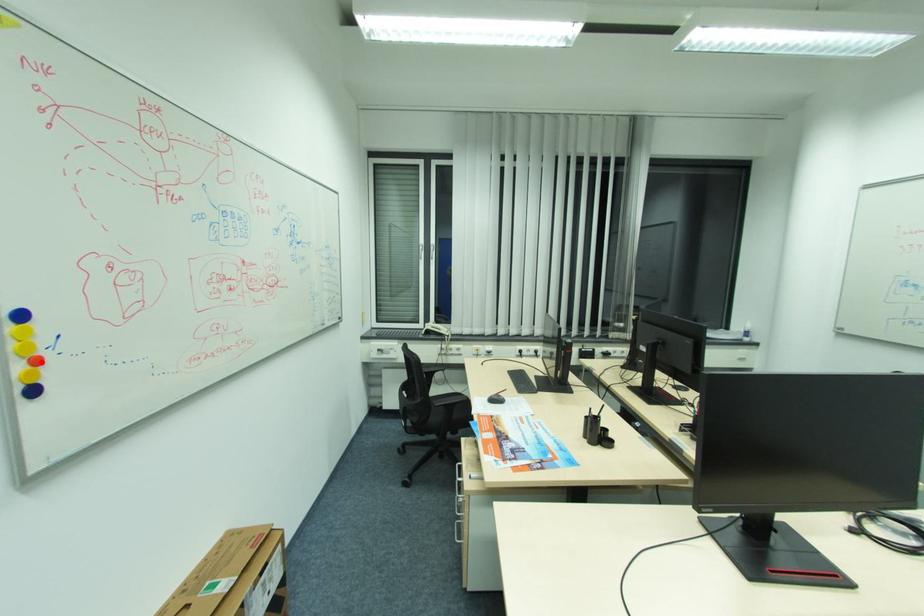
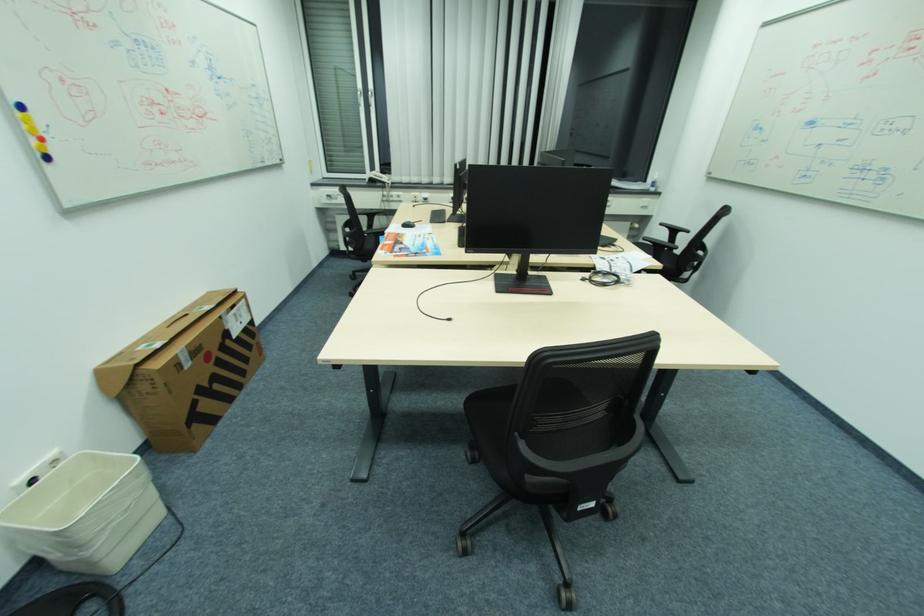
Question: I am providing you with two images of the same scene from different viewpoints. A red point is marked on the first image. Is the red point's position out of view in image 2?

Choices:
 (A) Yes
 (B) No

Answer: (B)